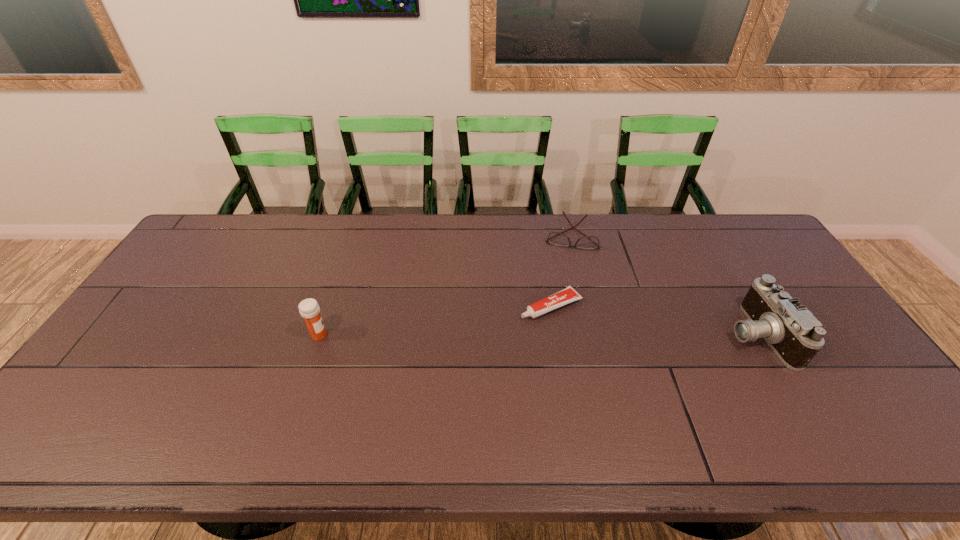
Locate an element on the screen. The image size is (960, 540). vacant space on the desktop that is between the leftmost object and the rightmost object and is positioned at the nozzle of the toothpaste is located at coordinates (487, 335).

Locate an element on the screen. The image size is (960, 540). vacant space on the desktop that is between the leftmost object and the camera and is positioned on the front-facing side of the spectacles is located at coordinates (559, 335).